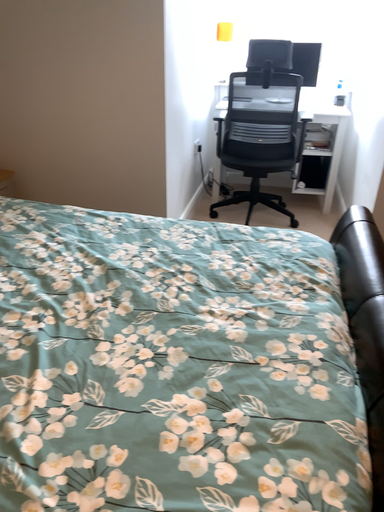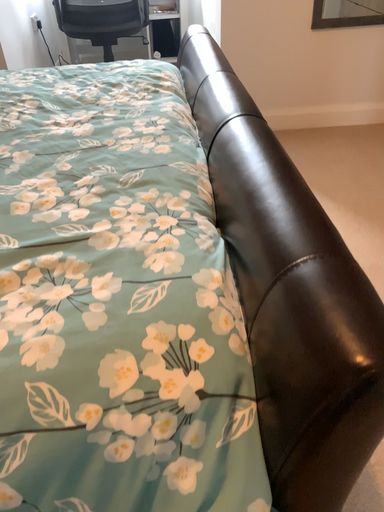
Question: How did the camera likely rotate when shooting the video?

Choices:
 (A) rotated right
 (B) rotated left

Answer: (A)